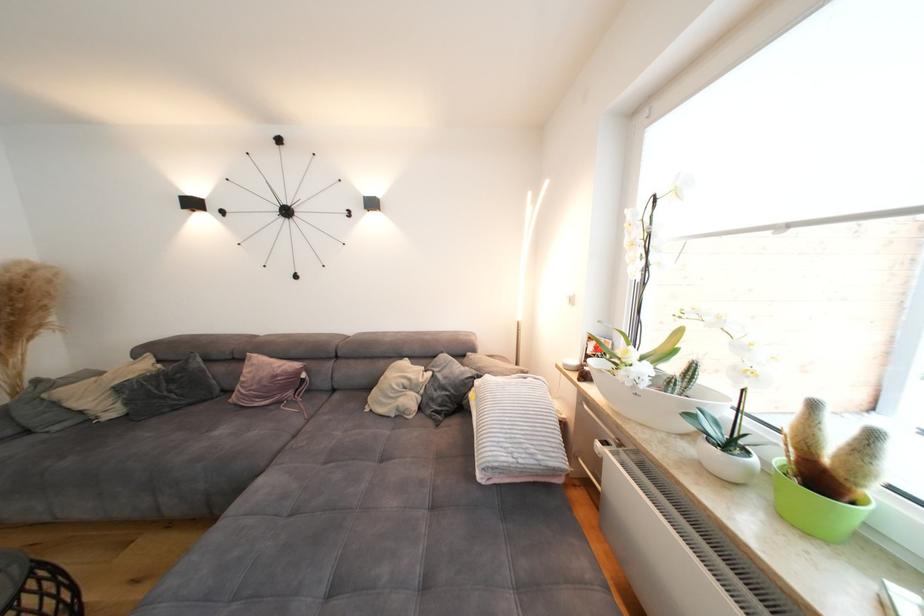
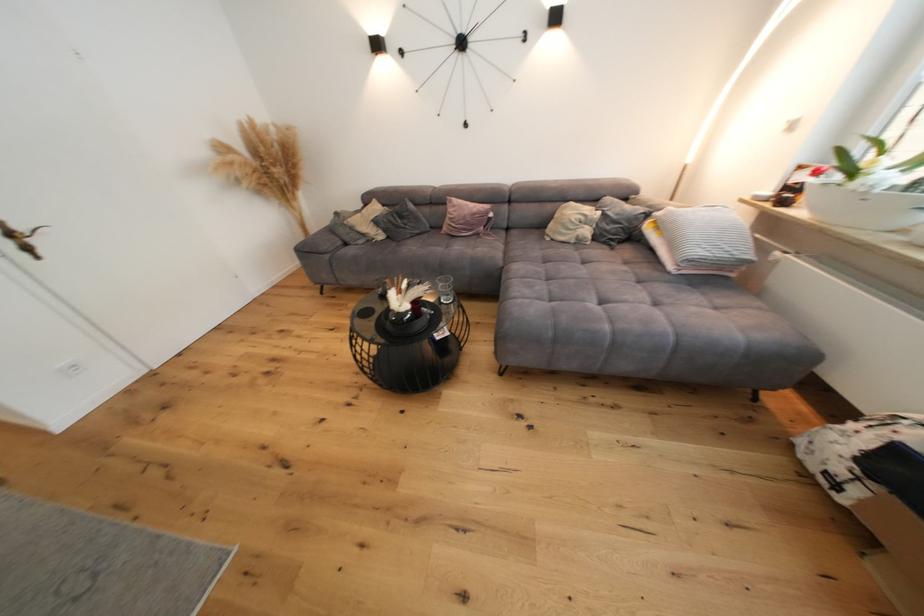
Where in the second image is the point corresponding to pixel 177 382 from the first image?

(408, 219)